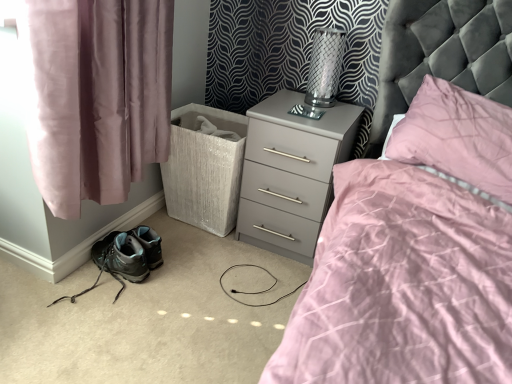
What are the coordinates of `white textured laundry basket at lower left` in the screenshot? It's located at (204, 169).

At what (x,y) coordinates should I click in order to perform the action: click on metallic mesh table lamp at upper right. Please return your answer as a coordinate pair (x, y). Looking at the image, I should click on (322, 73).

Describe the element at coordinates (457, 136) in the screenshot. The height and width of the screenshot is (384, 512). I see `pink satin pillow at upper right` at that location.

Measure the distance between point (75, 194) and camera.

A distance of 1.31 meters exists between point (75, 194) and camera.

At what (x,y) coordinates should I click in order to perform the action: click on white textured laundry basket at lower left. Please return your answer as a coordinate pair (x, y). This screenshot has height=384, width=512. Looking at the image, I should click on (204, 169).

From a real-world perspective, is white textured laundry basket at lower left on top of gray matte nightstand at center?

No, from a real-world perspective, white textured laundry basket at lower left is not on top of gray matte nightstand at center.

Are white textured laundry basket at lower left and gray matte nightstand at center beside each other?

There is a gap between white textured laundry basket at lower left and gray matte nightstand at center.

Measure the distance between white textured laundry basket at lower left and gray matte nightstand at center.

white textured laundry basket at lower left is 8.39 inches away from gray matte nightstand at center.

Does white textured laundry basket at lower left appear on the right side of gray matte nightstand at center?

No, white textured laundry basket at lower left is not to the right of gray matte nightstand at center.

In terms of height, does metallic mesh table lamp at upper right look taller or shorter compared to white textured laundry basket at lower left?

Clearly, metallic mesh table lamp at upper right is shorter compared to white textured laundry basket at lower left.

From the picture: From a real-world perspective, is metallic mesh table lamp at upper right located beneath white textured laundry basket at lower left?

Actually, metallic mesh table lamp at upper right is physically above white textured laundry basket at lower left in the real world.

Locate an element on the screen. laundry basket behind the metallic mesh table lamp at upper right is located at coordinates (204, 169).

What's the angular difference between metallic mesh table lamp at upper right and white textured laundry basket at lower left's facing directions?

1.04 degrees separate the facing orientations of metallic mesh table lamp at upper right and white textured laundry basket at lower left.

Does pink fabric curtain at left appear on the right side of metallic mesh table lamp at upper right?

No, pink fabric curtain at left is not to the right of metallic mesh table lamp at upper right.

Are pink fabric curtain at left and metallic mesh table lamp at upper right far apart?

They are positioned close to each other.

Between pink fabric curtain at left and metallic mesh table lamp at upper right, which one has larger width?

Wider between the two is pink fabric curtain at left.

Considering the positions of objects pink fabric curtain at left and gray matte nightstand at center in the image provided, who is more to the right, pink fabric curtain at left or gray matte nightstand at center?

gray matte nightstand at center.

Is pink fabric curtain at left far away from gray matte nightstand at center?

No, pink fabric curtain at left is not far from gray matte nightstand at center.

Does point (39, 2) lie behind point (280, 184)?

No.

From the image's perspective, which is below, pink fabric curtain at left or gray matte nightstand at center?

gray matte nightstand at center, from the image's perspective.

Where is `footwear behind the pink satin pillow at upper right`? The width and height of the screenshot is (512, 384). footwear behind the pink satin pillow at upper right is located at coordinates (125, 257).

Is matte gray hiking boots at lower left located within pink satin pillow at upper right?

No.

Consider the image. Is pink satin pillow at upper right facing away from matte gray hiking boots at lower left?

That's not correct — pink satin pillow at upper right is not looking away from matte gray hiking boots at lower left.

Which object is more forward, gray matte nightstand at center or white textured laundry basket at lower left?

Positioned in front is gray matte nightstand at center.

Could you tell me if gray matte nightstand at center is turned towards white textured laundry basket at lower left?

No.

From a real-world perspective, is gray matte nightstand at center physically located above or below white textured laundry basket at lower left?

From a real-world perspective, gray matte nightstand at center is physically above white textured laundry basket at lower left.

Based on their sizes in the image, would you say gray matte nightstand at center is bigger or smaller than white textured laundry basket at lower left?

Clearly, gray matte nightstand at center is larger in size than white textured laundry basket at lower left.

Can we say pink satin pillow at upper right lies outside pink fabric curtain at left?

Yes.

Does pink satin pillow at upper right have a greater height compared to pink fabric curtain at left?

No.

Is pink satin pillow at upper right facing towards pink fabric curtain at left?

No, pink satin pillow at upper right is not turned towards pink fabric curtain at left.

Is pink satin pillow at upper right to the left of pink fabric curtain at left from the viewer's perspective?

Incorrect, pink satin pillow at upper right is not on the left side of pink fabric curtain at left.

The height and width of the screenshot is (384, 512). I want to click on nightstand on the right of white textured laundry basket at lower left, so tap(291, 173).

In the image, there is a metallic mesh table lamp at upper right. Where is `laundry basket below it (from a real-world perspective)`? laundry basket below it (from a real-world perspective) is located at coordinates (204, 169).

When comparing their distances from gray matte nightstand at center, does white textured laundry basket at lower left or metallic mesh table lamp at upper right seem closer?

white textured laundry basket at lower left is closer to gray matte nightstand at center.

Looking at the image, which one is located closer to matte gray hiking boots at lower left, white textured laundry basket at lower left or pink fabric curtain at left?

white textured laundry basket at lower left is positioned closer to the anchor matte gray hiking boots at lower left.

Looking at the image, which one is located closer to white textured laundry basket at lower left, matte gray hiking boots at lower left or gray matte nightstand at center?

The object closer to white textured laundry basket at lower left is gray matte nightstand at center.

Considering their positions, is gray matte nightstand at center positioned closer to matte gray hiking boots at lower left than pink fabric curtain at left?

pink fabric curtain at left lies closer to matte gray hiking boots at lower left than the other object.

From the image, which object appears to be farther from gray matte nightstand at center, white textured laundry basket at lower left or pink satin pillow at upper right?

pink satin pillow at upper right lies further to gray matte nightstand at center than the other object.

From the picture: Looking at the image, which one is located further to matte gray hiking boots at lower left, pink fabric curtain at left or metallic mesh table lamp at upper right?

Among the two, metallic mesh table lamp at upper right is located further to matte gray hiking boots at lower left.

Looking at the image, which one is located closer to gray matte nightstand at center, metallic mesh table lamp at upper right or pink satin pillow at upper right?

The object closer to gray matte nightstand at center is metallic mesh table lamp at upper right.

Which object lies nearer to the anchor point matte gray hiking boots at lower left, pink fabric curtain at left or gray matte nightstand at center?

pink fabric curtain at left is closer to matte gray hiking boots at lower left.

Where is `laundry basket between matte gray hiking boots at lower left and metallic mesh table lamp at upper right`? The height and width of the screenshot is (384, 512). laundry basket between matte gray hiking boots at lower left and metallic mesh table lamp at upper right is located at coordinates (204, 169).

This screenshot has width=512, height=384. Find the location of `footwear between pink fabric curtain at left and white textured laundry basket at lower left along the z-axis`. footwear between pink fabric curtain at left and white textured laundry basket at lower left along the z-axis is located at coordinates (125, 257).

In order to click on laundry basket between matte gray hiking boots at lower left and gray matte nightstand at center in the horizontal direction in this screenshot , I will do `click(204, 169)`.

The image size is (512, 384). I want to click on table lamp located between pink fabric curtain at left and pink satin pillow at upper right in the left-right direction, so click(x=322, y=73).